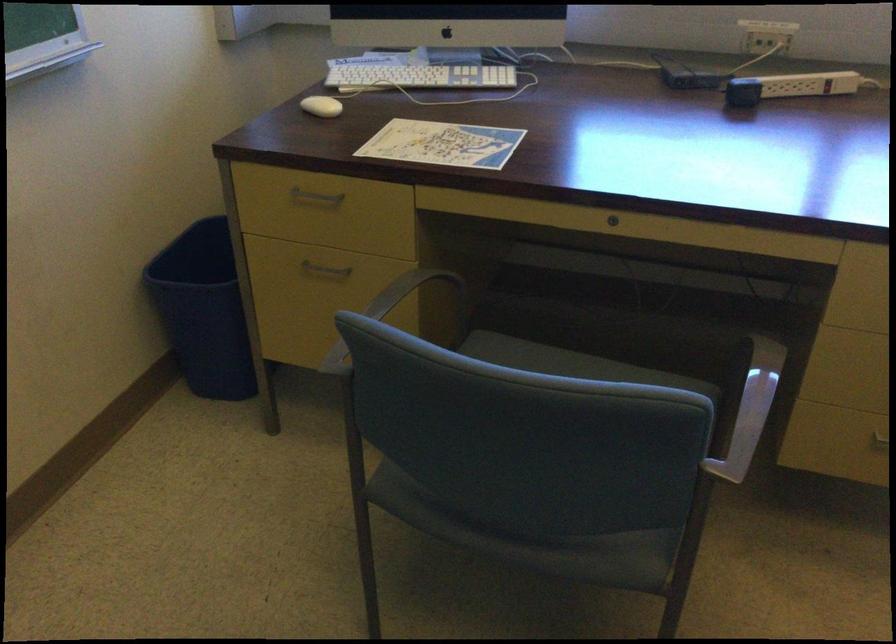
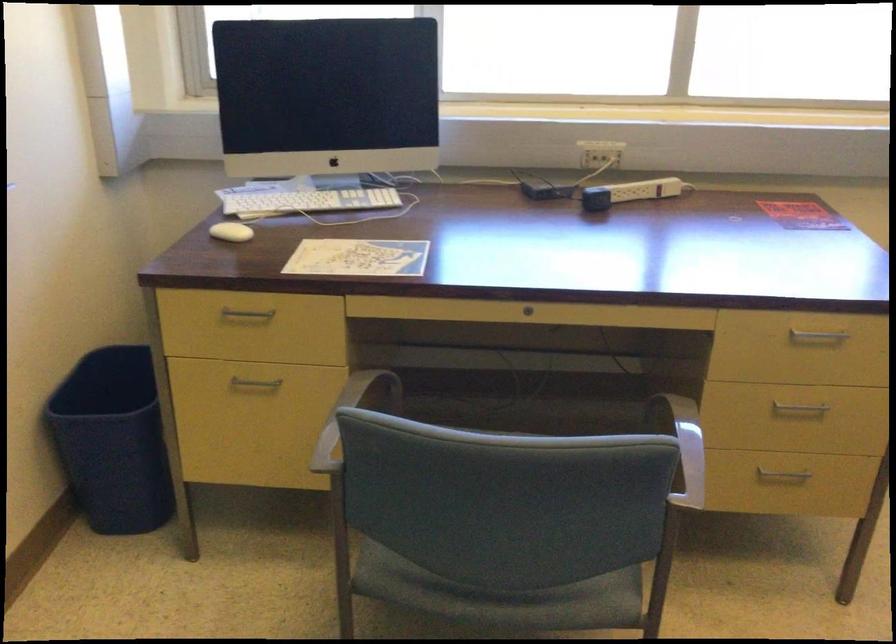
Where in the second image is the point corresponding to the point at 745,402 from the first image?

(684, 446)